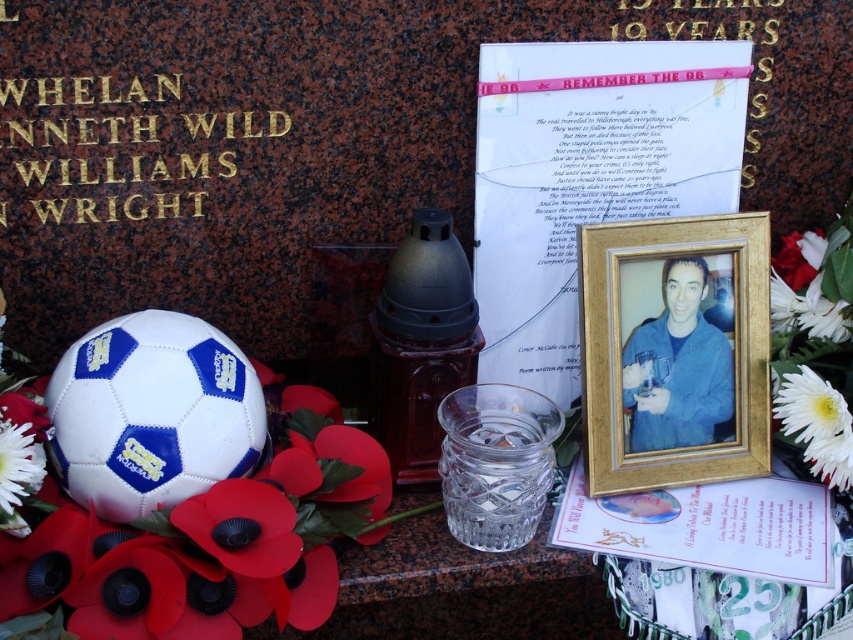
Question: Is silky fabric poppy at lower left to the left of blue denim jacket at center from the viewer's perspective?

Choices:
 (A) yes
 (B) no

Answer: (A)

Question: Which point is farther from the camera taking this photo?

Choices:
 (A) (657, 432)
 (B) (337, 586)
 (C) (599, 252)

Answer: (A)

Question: Considering the relative positions of silky fabric poppy at lower left and gold wooden photo frame at center in the image provided, where is silky fabric poppy at lower left located with respect to gold wooden photo frame at center?

Choices:
 (A) above
 (B) below

Answer: (B)

Question: Which point is closer to the camera?

Choices:
 (A) (305, 544)
 (B) (706, 342)
 (C) (706, 368)

Answer: (A)

Question: Which object is closer to the camera taking this photo?

Choices:
 (A) blue denim jacket at center
 (B) silky fabric poppy at lower left

Answer: (B)

Question: In this image, where is silky fabric poppy at lower left located relative to gold wooden photo frame at center?

Choices:
 (A) above
 (B) below

Answer: (B)